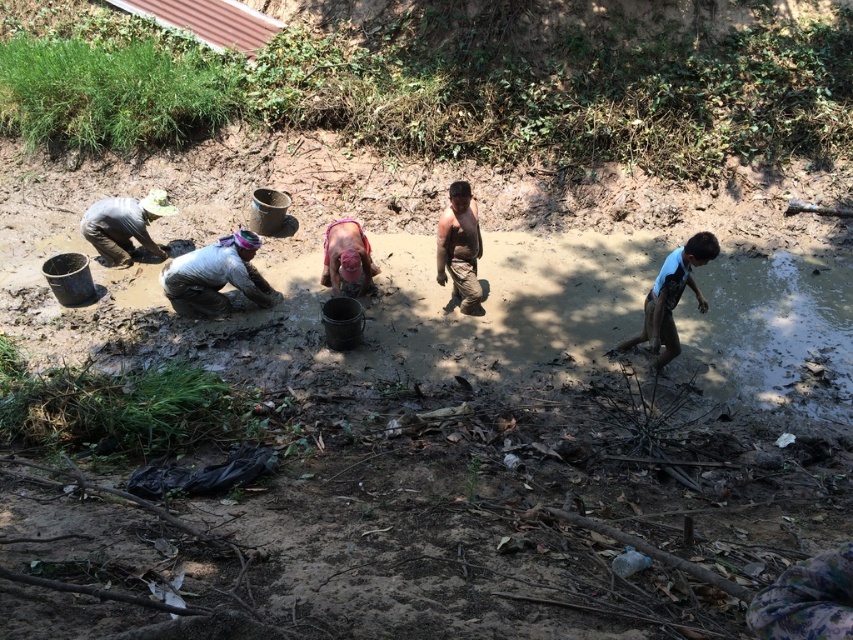
You are standing near the muddy water body and notice two workers wearing a light brown fabric shirt at center and a blue matte shirt at right. Which worker is shorter in height?

The light brown fabric shirt at center has a lesser height compared to the blue matte shirt at right, so the worker wearing the light brown fabric shirt at center is shorter.

Based on the scene description and the coordinates provided, which object is located at the point with coordinates (123, 225)?

The object located at the point with coordinates (123, 225) is the dark gray fabric shirt at left.